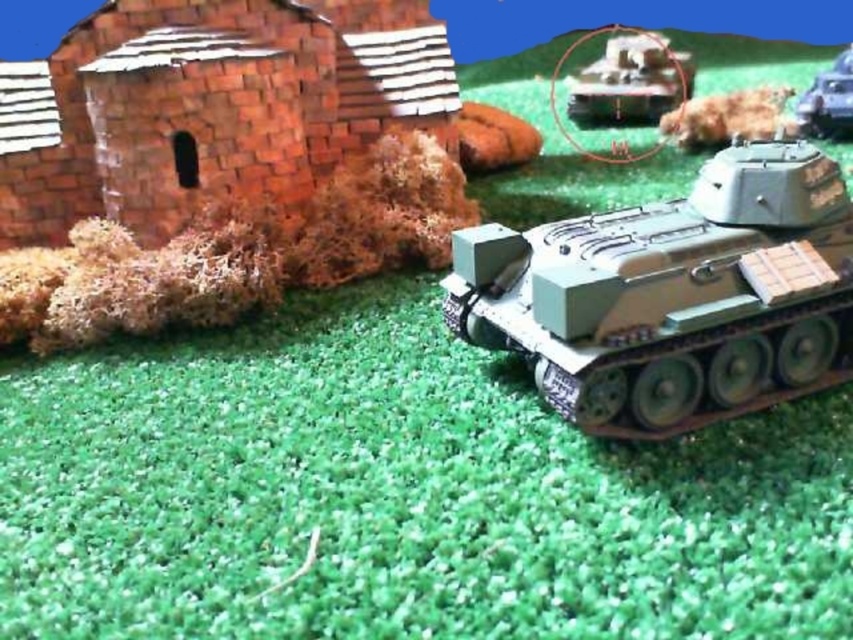
How much distance is there between camouflage plastic tank at lower right and brown fur dog at upper center?

1.44 meters

Who is more distant from viewer, (846, 369) or (724, 102)?

Positioned behind is point (724, 102).

Is point (567, 394) positioned in front of point (723, 104)?

Yes, it is.

Identify the location of camouflage plastic tank at lower right. The height and width of the screenshot is (640, 853). (672, 296).

Is matte gray tank at upper center bigger than matte green tank at center?

Indeed, matte gray tank at upper center has a larger size compared to matte green tank at center.

Is point (605, 70) less distant than point (849, 83)?

No, it is behind (849, 83).

At what (x,y) coordinates should I click in order to perform the action: click on matte gray tank at upper center. Please return your answer as a coordinate pair (x, y). Looking at the image, I should click on (630, 81).

Can you confirm if matte gray tank at upper center is positioned above brown fur dog at upper center?

Correct, matte gray tank at upper center is located above brown fur dog at upper center.

Locate an element on the screen. The height and width of the screenshot is (640, 853). matte gray tank at upper center is located at coordinates (630, 81).

Is point (567, 102) less distant than point (672, 128)?

No, it is behind (672, 128).

You are a GUI agent. You are given a task and a screenshot of the screen. Output one action in this format:
    pyautogui.click(x=<x>, y=<y>)
    Task: Click on the matte gray tank at upper center
    This screenshot has height=640, width=853.
    Given the screenshot: What is the action you would take?
    pyautogui.click(x=630, y=81)